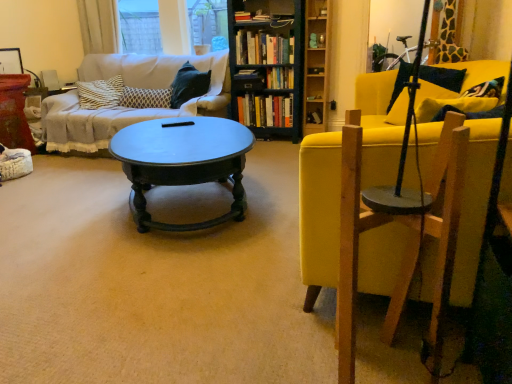
At what (x,y) coordinates should I click in order to perform the action: click on space that is in front of shiny dark wood coffee table at center. Please return your answer as a coordinate pair (x, y). Looking at the image, I should click on (159, 287).